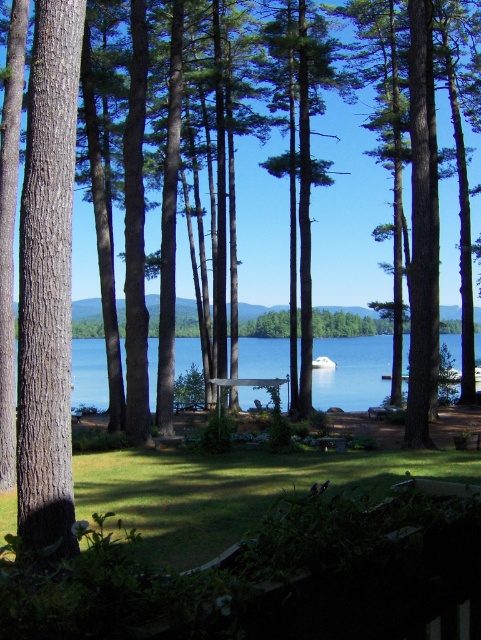
Question: Considering the relative positions of blue water at center and wooden picnic table at center in the image provided, where is blue water at center located with respect to wooden picnic table at center?

Choices:
 (A) right
 (B) left

Answer: (A)

Question: Is the position of blue water at center less distant than that of wooden picnic table at center?

Choices:
 (A) yes
 (B) no

Answer: (A)

Question: Is blue water at center below wooden picnic table at center?

Choices:
 (A) no
 (B) yes

Answer: (B)

Question: Among these objects, which one is farthest from the camera?

Choices:
 (A) blue water at center
 (B) wooden picnic table at center

Answer: (B)

Question: Which point is closer to the camera?

Choices:
 (A) blue water at center
 (B) wooden picnic table at center

Answer: (A)